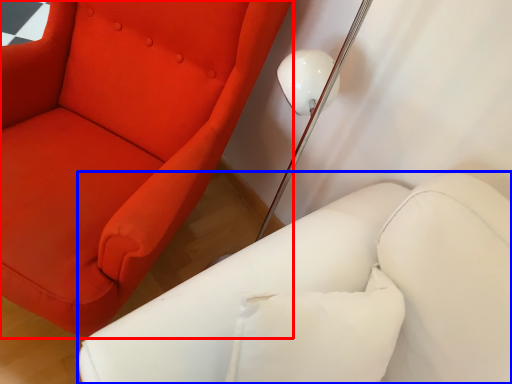
Question: Which of the following is the farthest to the observer, chair (highlighted by a red box) or furniture (highlighted by a blue box)?

Choices:
 (A) chair
 (B) furniture

Answer: (A)